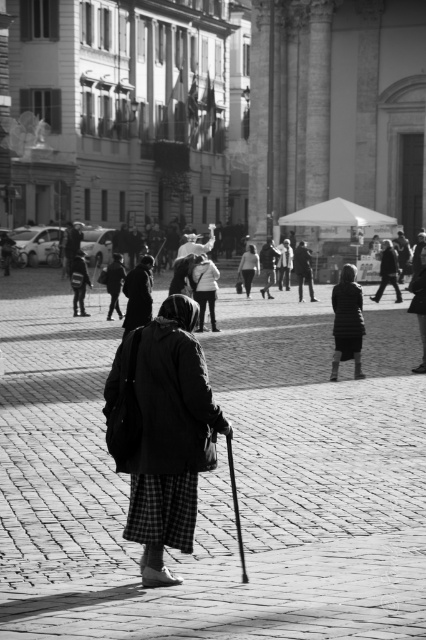
Where is `dark textured coat at center`? This screenshot has height=640, width=426. dark textured coat at center is located at coordinates (x=163, y=432).